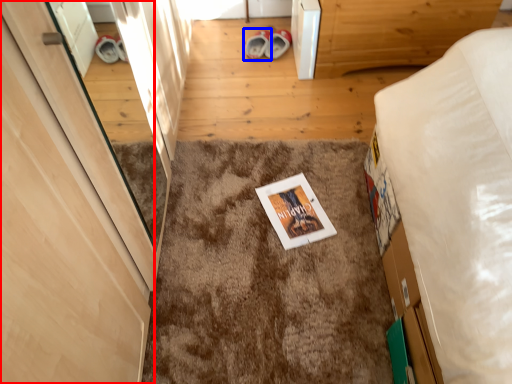
Question: Which of the following is the farthest to the observer, door (highlighted by a red box) or footwear (highlighted by a blue box)?

Choices:
 (A) door
 (B) footwear

Answer: (B)